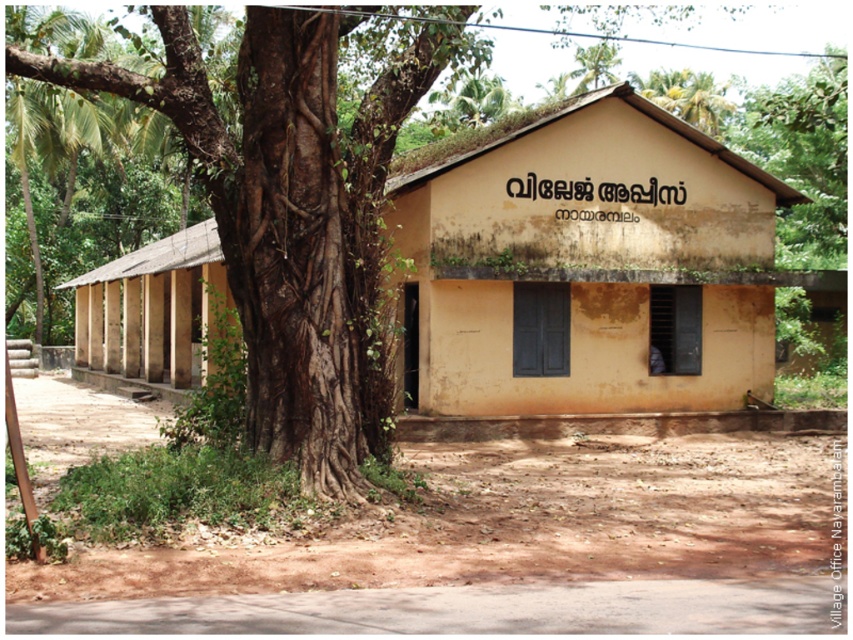
Question: Can you confirm if yellowish matte building at center is positioned below light brown wooden hut at left?

Choices:
 (A) yes
 (B) no

Answer: (B)

Question: Which object is positioned farthest from the light brown wooden hut at left?

Choices:
 (A) brown rough bark tree at center
 (B) yellowish matte building at center

Answer: (B)

Question: Among these points, which one is nearest to the camera?

Choices:
 (A) (379, 268)
 (B) (112, 301)
 (C) (579, 148)

Answer: (A)

Question: Can you confirm if yellowish matte building at center is bigger than light brown wooden hut at left?

Choices:
 (A) yes
 (B) no

Answer: (B)

Question: Considering the real-world distances, which object is closest to the yellowish matte building at center?

Choices:
 (A) light brown wooden hut at left
 (B) brown rough bark tree at center

Answer: (B)

Question: Can you confirm if yellowish matte building at center is smaller than light brown wooden hut at left?

Choices:
 (A) yes
 (B) no

Answer: (A)